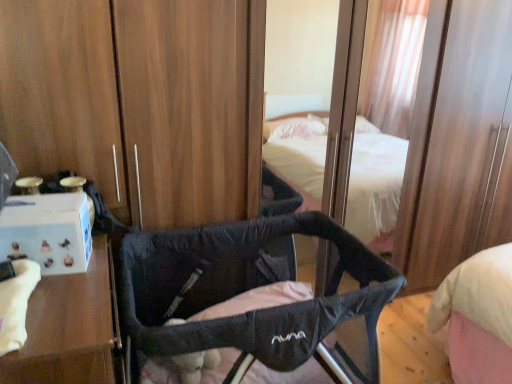
Question: Is point (35, 289) positioned closer to the camera than point (124, 246)?

Choices:
 (A) farther
 (B) closer

Answer: (B)

Question: Is white cardboard box at left inside the boundaries of black fabric infant bed at center, or outside?

Choices:
 (A) outside
 (B) inside

Answer: (A)

Question: From the image's perspective, relative to black fabric infant bed at center, is white cardboard box at left above or below?

Choices:
 (A) below
 (B) above

Answer: (A)

Question: In the image, is black fabric infant bed at center on the left side or the right side of white cardboard box at left?

Choices:
 (A) left
 (B) right

Answer: (B)

Question: Is black fabric infant bed at center spatially inside white cardboard box at left, or outside of it?

Choices:
 (A) inside
 (B) outside

Answer: (B)

Question: From the image's perspective, is black fabric infant bed at center positioned above or below white cardboard box at left?

Choices:
 (A) above
 (B) below

Answer: (A)

Question: From a real-world perspective, is black fabric infant bed at center above or below white cardboard box at left?

Choices:
 (A) below
 (B) above

Answer: (A)